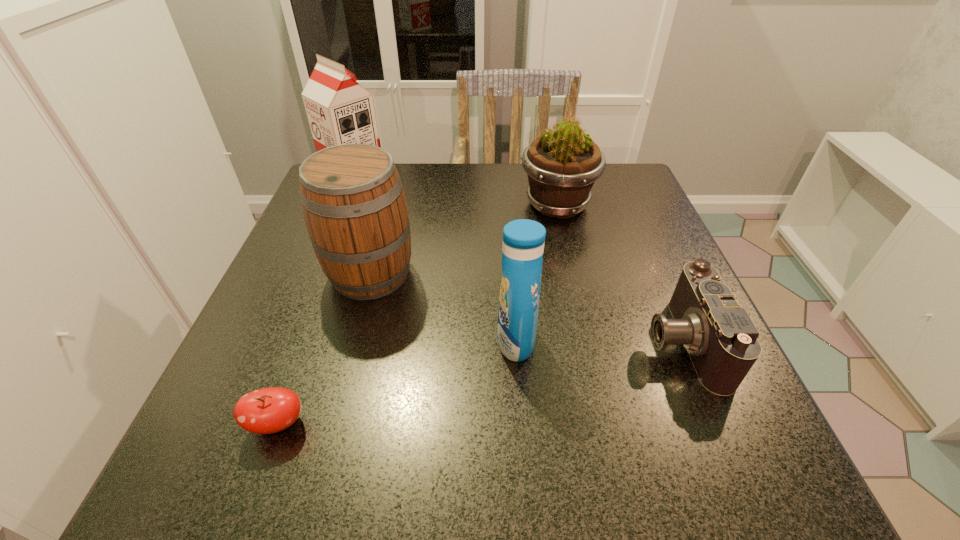
Identify the location of object that is at the near edge. This screenshot has height=540, width=960. (269, 410).

Locate an element on the screen. soya milk at the left edge is located at coordinates point(340,111).

The image size is (960, 540). Identify the location of cider that is at the left edge. (352, 197).

The image size is (960, 540). Identify the location of apple at the left edge. (269, 410).

At what (x,y) coordinates should I click in order to perform the action: click on flowerpot that is at the right edge. Please return your answer as a coordinate pair (x, y). This screenshot has width=960, height=540. Looking at the image, I should click on (562, 164).

Where is `camera positioned at the right edge`? camera positioned at the right edge is located at coordinates (721, 339).

Identify the location of object that is at the far left corner. This screenshot has width=960, height=540. (340, 111).

This screenshot has width=960, height=540. What are the coordinates of `object located at the near left corner` in the screenshot? It's located at (269, 410).

You are a GUI agent. You are given a task and a screenshot of the screen. Output one action in this format:
    pyautogui.click(x=<x>, y=<y>)
    Task: Click on the object situated at the far right corner
    This screenshot has height=540, width=960.
    Given the screenshot: What is the action you would take?
    pyautogui.click(x=562, y=164)

You are a GUI agent. You are given a task and a screenshot of the screen. Output one action in this format:
    pyautogui.click(x=<x>, y=<y>)
    Task: Click on the vacant space at the far edge of the desktop
    The width and height of the screenshot is (960, 540).
    Given the screenshot: What is the action you would take?
    pyautogui.click(x=415, y=170)